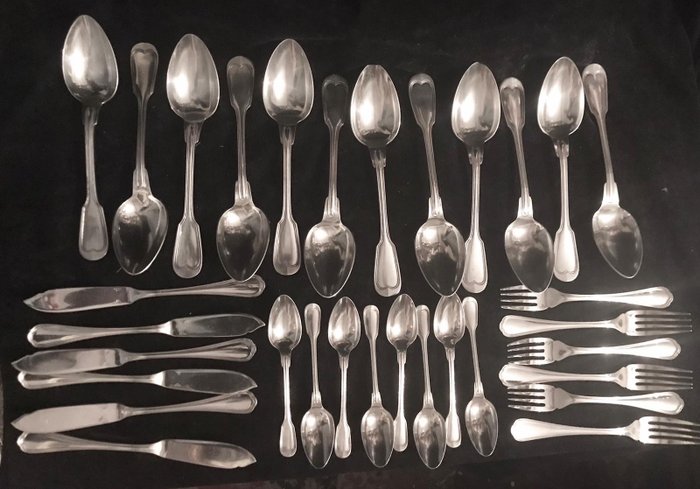
Find the location of a particular element. fork is located at coordinates (662, 428), (546, 397), (673, 378), (536, 351), (671, 319), (533, 299).